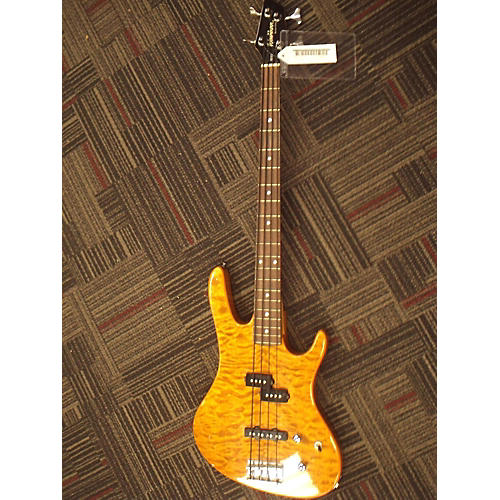
Where is `electric control dials`? This screenshot has width=500, height=500. electric control dials is located at coordinates (301, 467), (294, 438), (318, 445).